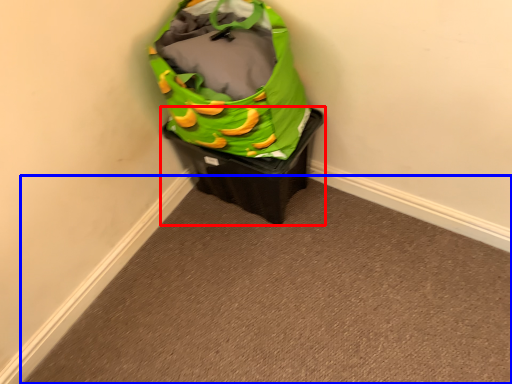
Question: Which object appears closest to the camera in this image, waste container (highlighted by a red box) or plain (highlighted by a blue box)?

Choices:
 (A) waste container
 (B) plain

Answer: (B)